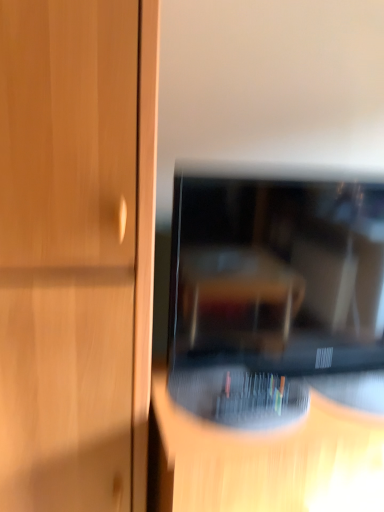
Question: Would you consider black glossy television at center to be distant from transparent plastic cd case at center?

Choices:
 (A) yes
 (B) no

Answer: (B)

Question: Could you tell me if black glossy television at center is facing transparent plastic cd case at center?

Choices:
 (A) yes
 (B) no

Answer: (B)

Question: From a real-world perspective, is black glossy television at center over transparent plastic cd case at center?

Choices:
 (A) no
 (B) yes

Answer: (B)

Question: From the image's perspective, is black glossy television at center below transparent plastic cd case at center?

Choices:
 (A) yes
 (B) no

Answer: (B)

Question: Is black glossy television at center looking in the opposite direction of transparent plastic cd case at center?

Choices:
 (A) no
 (B) yes

Answer: (A)

Question: From a real-world perspective, is black glossy television at center below transparent plastic cd case at center?

Choices:
 (A) yes
 (B) no

Answer: (B)

Question: Does transparent plastic cd case at center have a lesser height compared to black glossy television at center?

Choices:
 (A) yes
 (B) no

Answer: (B)

Question: Does transparent plastic cd case at center come in front of black glossy television at center?

Choices:
 (A) yes
 (B) no

Answer: (A)

Question: Considering the relative sizes of transparent plastic cd case at center and black glossy television at center in the image provided, is transparent plastic cd case at center bigger than black glossy television at center?

Choices:
 (A) yes
 (B) no

Answer: (A)

Question: Is transparent plastic cd case at center facing away from black glossy television at center?

Choices:
 (A) yes
 (B) no

Answer: (B)

Question: From a real-world perspective, is transparent plastic cd case at center physically below black glossy television at center?

Choices:
 (A) yes
 (B) no

Answer: (A)

Question: Considering the relative sizes of transparent plastic cd case at center and black glossy television at center in the image provided, is transparent plastic cd case at center taller than black glossy television at center?

Choices:
 (A) yes
 (B) no

Answer: (A)

Question: From the image's perspective, is black glossy television at center located above or below transparent plastic cd case at center?

Choices:
 (A) above
 (B) below

Answer: (A)